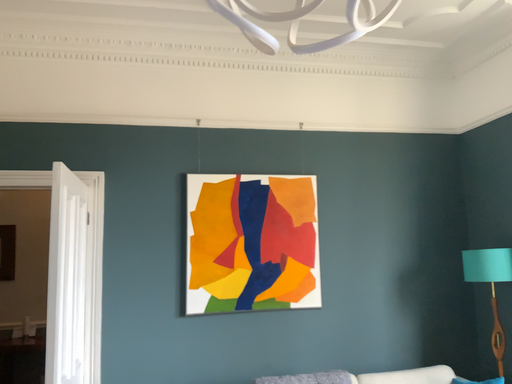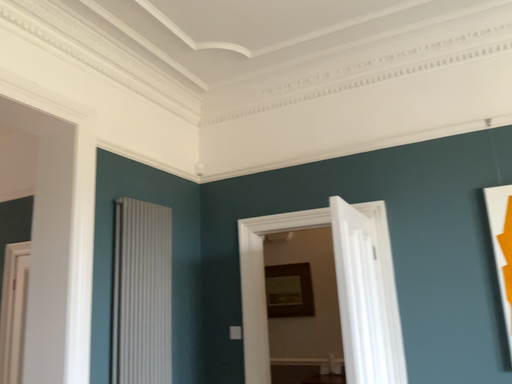
Question: How did the camera likely rotate when shooting the video?

Choices:
 (A) rotated right
 (B) rotated left

Answer: (B)